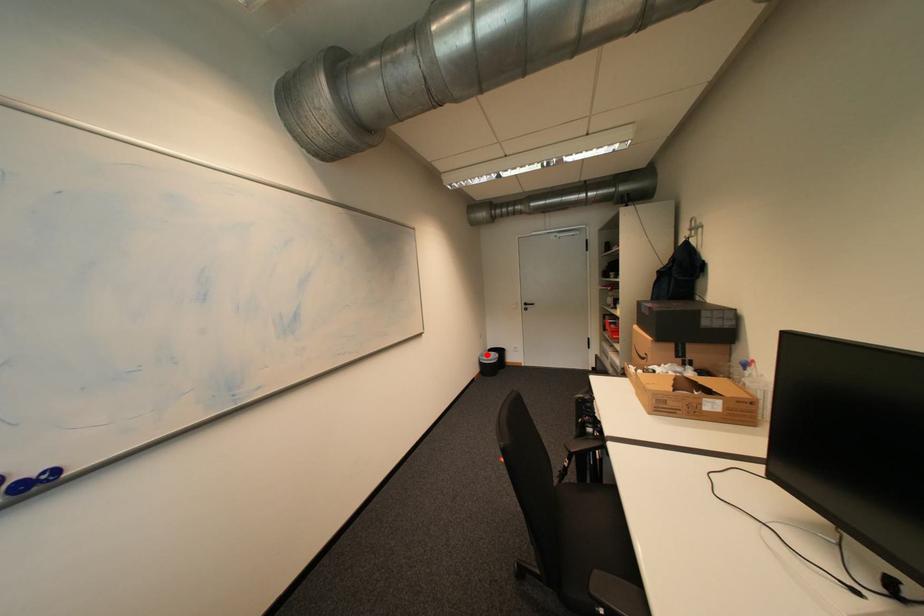
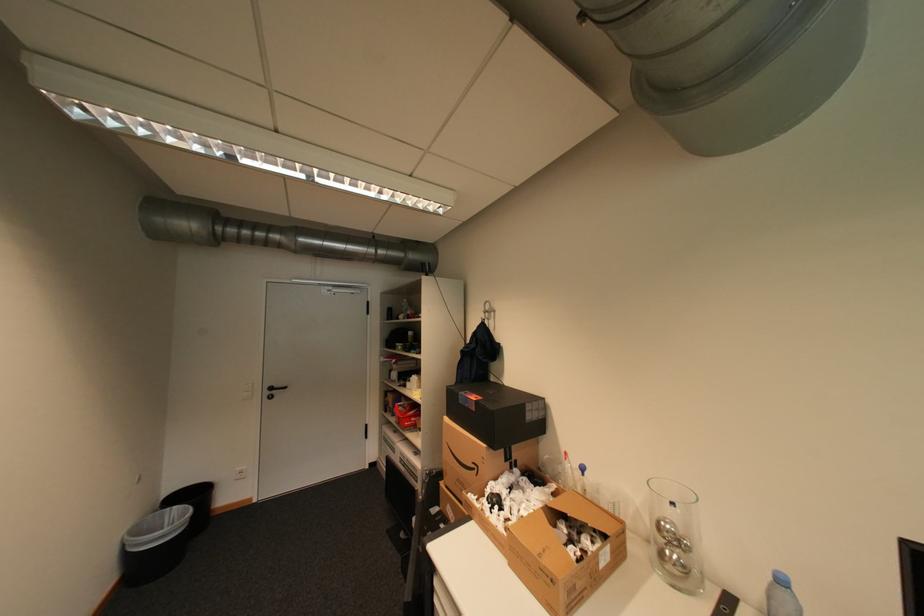
In the second image, find the point that corresponds to the highlighted location in the first image.

(132, 531)